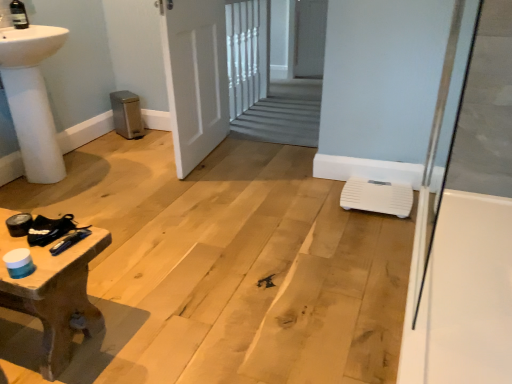
Measure the distance between metallic blue screwdriver at lower left and camera.

1.14 meters.

Image resolution: width=512 pixels, height=384 pixels. What do you see at coordinates (174, 68) in the screenshot?
I see `white matte door at center` at bounding box center [174, 68].

The height and width of the screenshot is (384, 512). Describe the element at coordinates (377, 197) in the screenshot. I see `white plastic scale at lower right` at that location.

I want to click on white glossy bath at right, so click(468, 230).

At what (x,y) coordinates should I click in order to perform the action: click on metallic blue screwdriver at lower left. Please return your answer as a coordinate pair (x, y). This screenshot has width=512, height=384. Looking at the image, I should click on (70, 240).

From the image's perspective, does white plastic scale at lower right appear higher than wooden textured table at lower left?

Yes.

Is white plastic scale at lower right to the left of wooden textured table at lower left from the viewer's perspective?

Incorrect, white plastic scale at lower right is not on the left side of wooden textured table at lower left.

Considering the relative positions of white plastic scale at lower right and wooden textured table at lower left in the image provided, is white plastic scale at lower right in front of wooden textured table at lower left?

No, it is not.

Do you think white plastic scale at lower right is within metallic blue screwdriver at lower left, or outside of it?

white plastic scale at lower right is not inside metallic blue screwdriver at lower left, it's outside.

Which is behind, white plastic scale at lower right or metallic blue screwdriver at lower left?

white plastic scale at lower right is behind.

Is white plastic scale at lower right at the left side of metallic blue screwdriver at lower left?

No.

Considering the relative sizes of metallic blue screwdriver at lower left and white plastic scale at lower right in the image provided, is metallic blue screwdriver at lower left bigger than white plastic scale at lower right?

No.

Is metallic blue screwdriver at lower left positioned in front of white plastic scale at lower right?

Yes, it is in front of white plastic scale at lower right.

How far apart are metallic blue screwdriver at lower left and white plastic scale at lower right?

A distance of 1.41 meters exists between metallic blue screwdriver at lower left and white plastic scale at lower right.

Who is shorter, metallic blue screwdriver at lower left or white plastic scale at lower right?

metallic blue screwdriver at lower left.

Is point (403, 203) positioned before point (178, 85)?

Yes.

From the image's perspective, relative to white matte door at center, is white plastic scale at lower right above or below?

Clearly, from the image's perspective, white plastic scale at lower right is below white matte door at center.

Are white plastic scale at lower right and white matte door at center located far from each other?

That's right, there is a large distance between white plastic scale at lower right and white matte door at center.

From the picture: Can you tell me how much white matte door at center and white glossy bath at right differ in facing direction?

The facing directions of white matte door at center and white glossy bath at right are 0.457 degrees apart.

From a real-world perspective, is white matte door at center on white glossy bath at right?

No.

Considering the sizes of white matte door at center and white glossy bath at right in the image, is white matte door at center wider or thinner than white glossy bath at right?

white matte door at center is wider than white glossy bath at right.

Which object is more forward, white matte door at center or white glossy bath at right?

white glossy bath at right is closer to the camera.

Is white glossy bath at right not inside wooden textured table at lower left?

Absolutely, white glossy bath at right is external to wooden textured table at lower left.

Can you confirm if white glossy bath at right is positioned to the right of wooden textured table at lower left?

Yes, white glossy bath at right is to the right of wooden textured table at lower left.

From the image's perspective, which one is positioned higher, white glossy bath at right or wooden textured table at lower left?

white glossy bath at right appears higher in the image.

Is white glossy bath at right closer to camera compared to wooden textured table at lower left?

Yes, white glossy bath at right is closer to the viewer.

Is point (201, 81) less distant than point (37, 306)?

No, it is behind (37, 306).

Is white matte door at center positioned in front of wooden textured table at lower left?

No, white matte door at center is behind wooden textured table at lower left.

Is white matte door at center positioned far away from wooden textured table at lower left?

Absolutely, white matte door at center is distant from wooden textured table at lower left.

In terms of height, does white matte door at center look taller or shorter compared to wooden textured table at lower left?

Clearly, white matte door at center is taller compared to wooden textured table at lower left.

The width and height of the screenshot is (512, 384). Find the location of `table on the left of white plastic scale at lower right`. table on the left of white plastic scale at lower right is located at coordinates (53, 292).

Identify the location of water heater below the metallic blue screwdriver at lower left (from a real-world perspective). The width and height of the screenshot is (512, 384). (377, 197).

Looking at this image, when comparing their distances from white matte door at center, does metallic blue screwdriver at lower left or white plastic scale at lower right seem closer?

Among the two, white plastic scale at lower right is located nearer to white matte door at center.

Based on the photo, which object lies nearer to the anchor point white plastic scale at lower right, metallic blue screwdriver at lower left or white glossy bath at right?

white glossy bath at right is closer to white plastic scale at lower right.

When comparing their distances from metallic blue screwdriver at lower left, does white plastic scale at lower right or white matte door at center seem closer?

Based on the image, white plastic scale at lower right appears to be nearer to metallic blue screwdriver at lower left.

Which object lies further to the anchor point white plastic scale at lower right, wooden textured table at lower left or white glossy bath at right?

wooden textured table at lower left lies further to white plastic scale at lower right than the other object.

From the image, which object appears to be nearer to white plastic scale at lower right, white matte door at center or white glossy bath at right?

white glossy bath at right.

Based on the photo, based on their spatial positions, is white matte door at center or wooden textured table at lower left closer to white glossy bath at right?

wooden textured table at lower left.

From the image, which object appears to be nearer to white matte door at center, white glossy bath at right or metallic blue screwdriver at lower left?

Based on the image, white glossy bath at right appears to be nearer to white matte door at center.

From the image, which object appears to be farther from white matte door at center, wooden textured table at lower left or white glossy bath at right?

The object further to white matte door at center is white glossy bath at right.

Locate an element on the screen. door between metallic blue screwdriver at lower left and white glossy bath at right is located at coordinates (174, 68).

Where is `tool between wooden textured table at lower left and white glossy bath at right from left to right`? tool between wooden textured table at lower left and white glossy bath at right from left to right is located at coordinates (70, 240).

Locate an element on the screen. The image size is (512, 384). tool situated between wooden textured table at lower left and white plastic scale at lower right from left to right is located at coordinates (70, 240).

Identify the location of door between wooden textured table at lower left and white glossy bath at right. Image resolution: width=512 pixels, height=384 pixels. (174, 68).